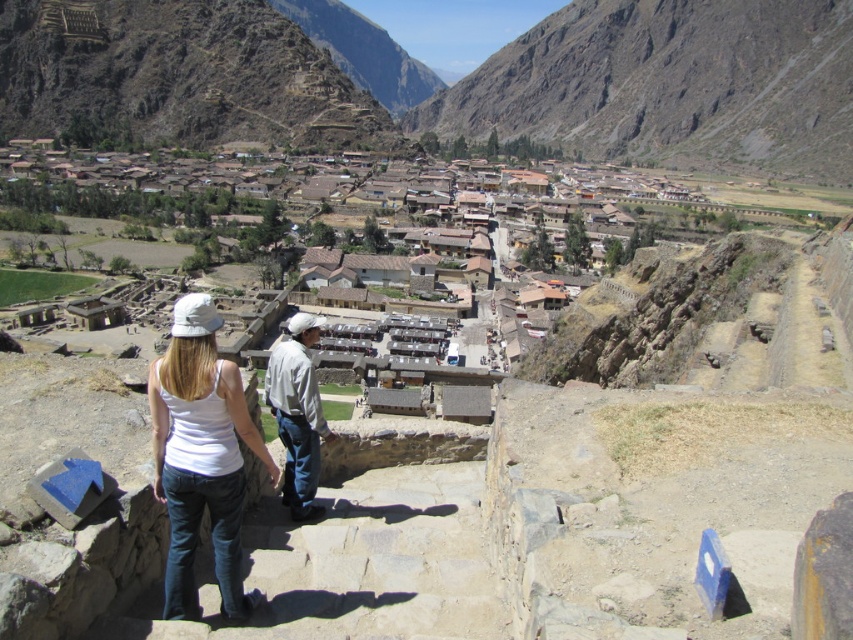
Based on the photo, you are a hiker who has just reached the top of a mountain and is looking down at the village. You notice two people wearing the white cotton tank top at center and the light gray cotton shirt at center. Which of their clothing items would you estimate has a smaller thickness when folded into a backpack?

The white cotton tank top at center is thinner than the light gray cotton shirt at center, so the white cotton tank top at center would take up less space when folded into a backpack.

You are standing at the camera position looking at the village. There is a point marked at coordinates point (180, 586). Can you determine if this point is within the village boundaries based on the scene description?

The point (180, 586) is 87.48 feet from the camera. Since the village is spread out across the valley floor and the point is at a distance of 87.48 feet from the camera, it is likely within the village boundaries as described.